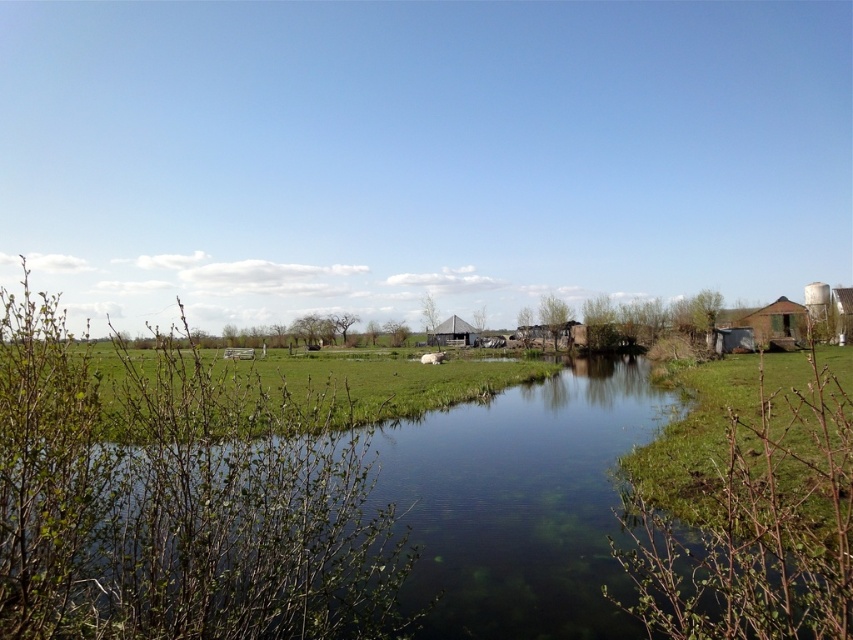
Question: Which of the following is the closest to the observer?

Choices:
 (A) (694, 385)
 (B) (477, 330)

Answer: (A)

Question: Among these objects, which one is farthest from the camera?

Choices:
 (A) gray corrugated metal hut at center
 (B) green grass at lower right

Answer: (A)

Question: Is green grass at center thinner than gray corrugated metal hut at center?

Choices:
 (A) no
 (B) yes

Answer: (A)

Question: Considering the relative positions of green grass at center and green grass at lower right in the image provided, where is green grass at center located with respect to green grass at lower right?

Choices:
 (A) right
 (B) left

Answer: (B)

Question: Which point appears farthest from the camera in this image?

Choices:
 (A) (668, 436)
 (B) (271, 358)
 (C) (782, 346)
 (D) (474, 333)

Answer: (D)

Question: Is green grass at center positioned in front of green grass at lower right?

Choices:
 (A) yes
 (B) no

Answer: (B)